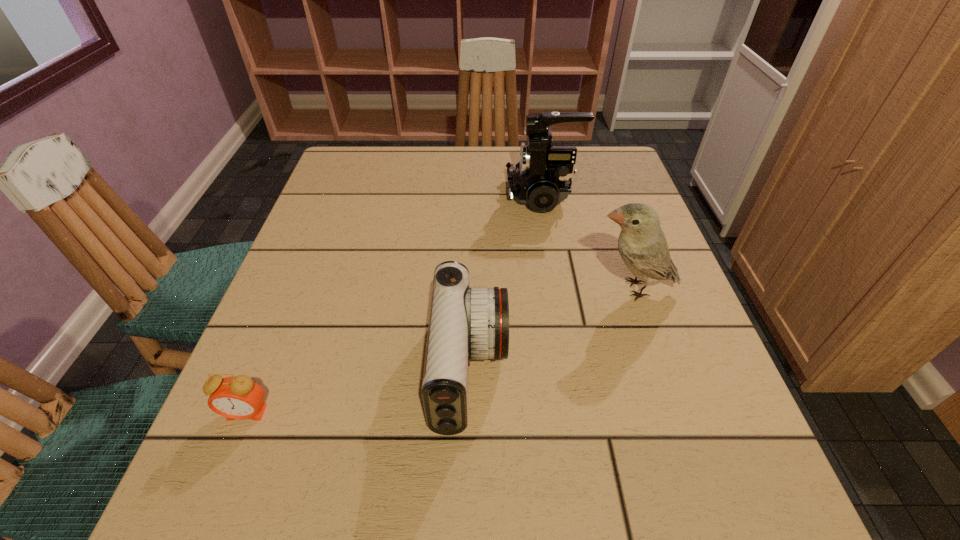
Where is `free spot between the alarm clock and the farthest object`? free spot between the alarm clock and the farthest object is located at coordinates (395, 304).

Identify the location of free space between the alarm clock and the third tallest object. (358, 392).

At what (x,y) coordinates should I click in order to perform the action: click on vacant area that lies between the shorter camcorder and the bird. Please return your answer as a coordinate pair (x, y). The width and height of the screenshot is (960, 540). Looking at the image, I should click on (551, 329).

Identify the location of vacant space that's between the left camcorder and the alarm clock. (358, 392).

What are the coordinates of `free spot between the nearer camcorder and the farthest object` in the screenshot? It's located at (506, 283).

This screenshot has height=540, width=960. I want to click on free point between the right camcorder and the bird, so click(x=588, y=242).

What are the coordinates of `object that is the third closest to the nearer camcorder` in the screenshot? It's located at (542, 179).

Select which object appears as the closest to the taller camcorder. Please provide its 2D coordinates. Your answer should be formatted as a tuple, i.e. [(x, y)], where the tuple contains the x and y coordinates of a point satisfying the conditions above.

[(642, 245)]

The image size is (960, 540). Identify the location of free location that satisfies the following two spatial constraints: 1. at the face of the second farthest object; 2. on the face of the leftmost object. (674, 413).

This screenshot has height=540, width=960. In order to click on vacant area in the image that satisfies the following two spatial constraints: 1. on the lens mount of the right camcorder; 2. on the face of the leftmost object in this screenshot , I will do `click(580, 413)`.